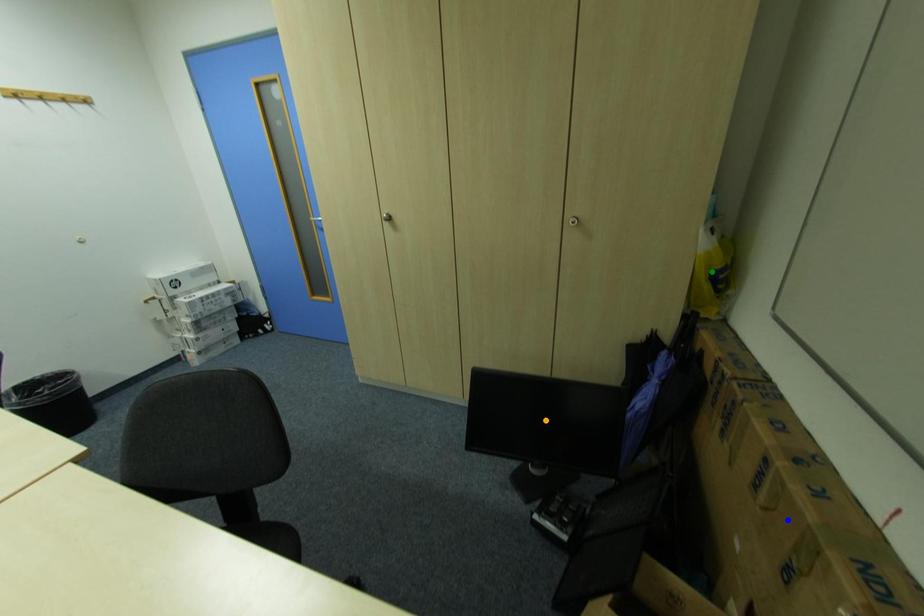
Order these from nearest to farthest:
green point, orange point, blue point

1. orange point
2. green point
3. blue point